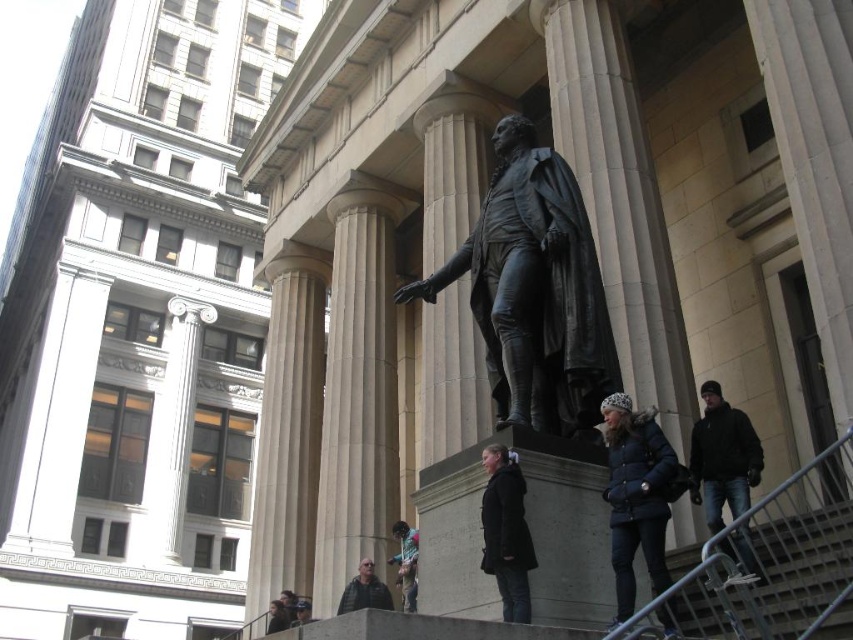
You are an architect designing a new pathway in front of the grand structure. The pathway must be wide enough to allow a delivery truck that is 40 feet long to pass between the smooth stone column at center and the beige stone column at center. Based on the scene description, will the truck fit through the space between these two columns?

The distance between the smooth stone column at center and the beige stone column at center is 44.89 feet, which is wider than the 40 feet length of the delivery truck. Therefore, the truck will fit through the space between these two columns.

You are a tourist standing at the entrance of the grand classical building. You notice a point marked at coordinates (618, 200). What object is located at that specific point?

The point at coordinates (618, 200) is occupied by a smooth stone column at center.